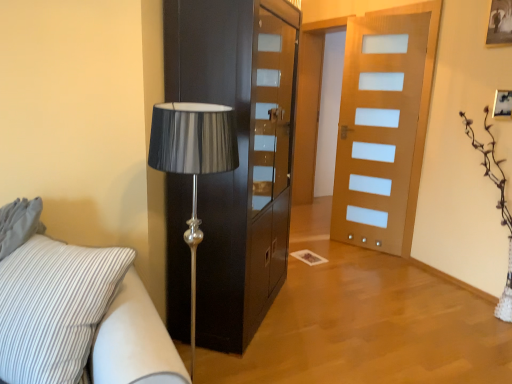
This screenshot has height=384, width=512. What are the coordinates of `vacant region below wooden door at center (from a real-world perspective)` in the screenshot? It's located at (364, 244).